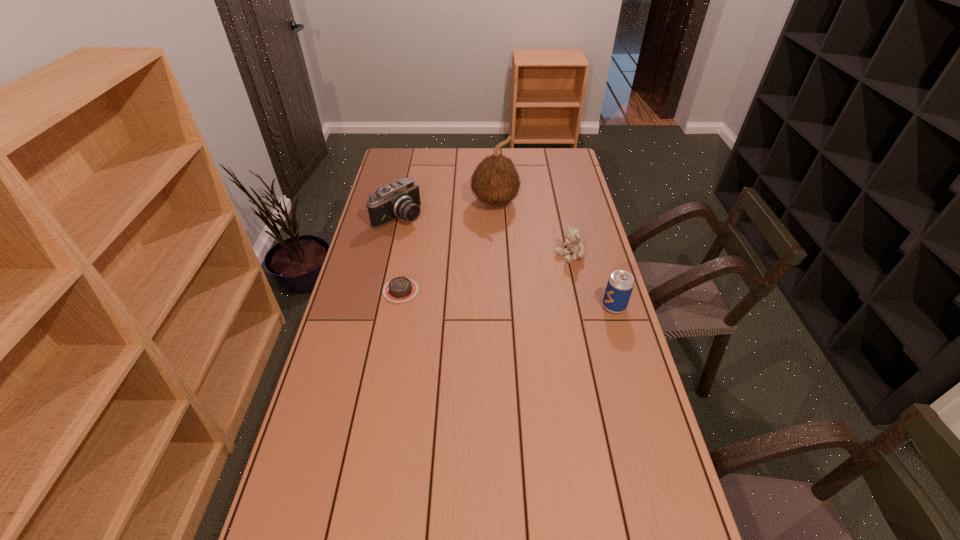
Identify the location of free space in the image that satisfies the following two spatial constraints: 1. on the front side of the camera; 2. on the left side of the rightmost object. (378, 306).

You are a GUI agent. You are given a task and a screenshot of the screen. Output one action in this format:
    pyautogui.click(x=<x>, y=<y>)
    Task: Click on the free space that satisfies the following two spatial constraints: 1. on the front side of the rightmost object; 2. on the right side of the third object from left to right
    The height and width of the screenshot is (540, 960).
    Given the screenshot: What is the action you would take?
    pyautogui.click(x=499, y=306)